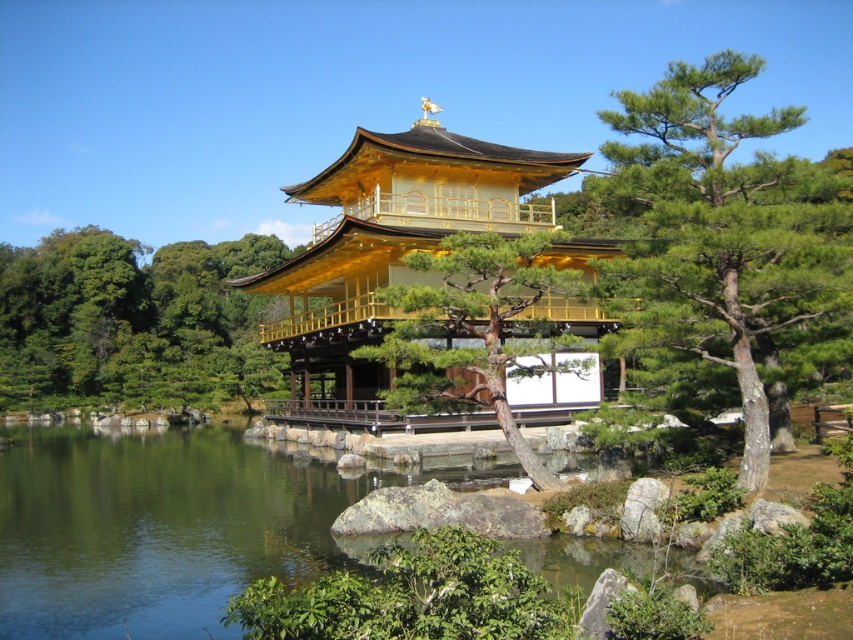
You are a photographer planning to capture the Golden Pavilion and its surroundings. You notice two pine trees in the scene. Which pine tree, the green textured pine tree at upper right or the smooth bark pine tree at center, would you focus on to highlight its size in relation to the Golden Pavilion?

The green textured pine tree at upper right is larger in size than the smooth bark pine tree at center, so focusing on the green textured pine tree at upper right would better highlight its size in relation to the Golden Pavilion.

You are visiting the Kinkakuji Temple and want to take a photo that includes both the golden polished wood temple at center and the smooth bark pine tree at center. Which object should you position closer to the front of the frame to ensure both are fully visible in the photo?

The golden polished wood temple at center is much taller than the smooth bark pine tree at center. To ensure both are fully visible in the photo, position the shorter smooth bark pine tree at center closer to the front of the frame so that its entire height can be captured alongside the taller temple.